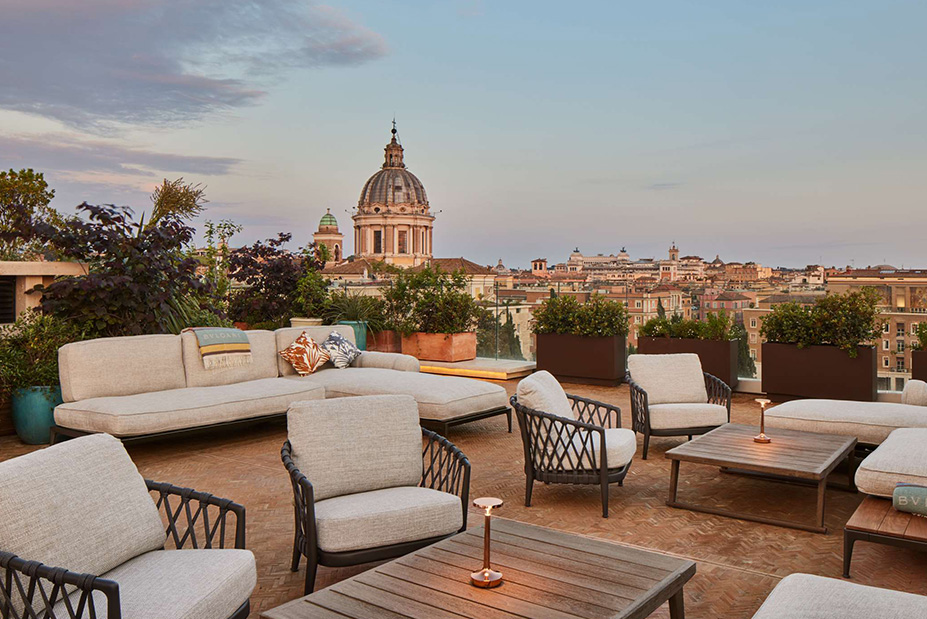
Identify the location of blanket. This screenshot has width=927, height=619. (231, 340).